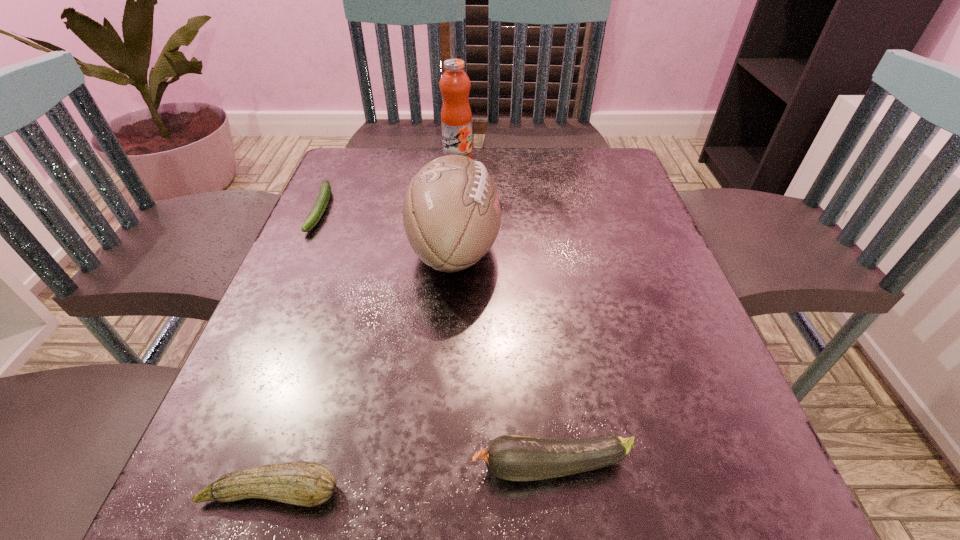
Locate an element on the screen. vacant space located 0.140m at the blossom end of the rightmost zucchini is located at coordinates (371, 466).

This screenshot has width=960, height=540. I want to click on vacant space located on the front-facing side of the farthest zucchini, so click(x=300, y=258).

You are a GUI agent. You are given a task and a screenshot of the screen. Output one action in this format:
    pyautogui.click(x=<x>, y=<y>)
    Task: Click on the fruit juice located at the far edge
    The height and width of the screenshot is (540, 960).
    Given the screenshot: What is the action you would take?
    [x=456, y=118]

What are the coordinates of `zucchini positioned at the far edge` in the screenshot? It's located at (321, 203).

Locate an element on the screen. object that is at the far left corner is located at coordinates (321, 203).

Where is `object at the near left corner`? This screenshot has width=960, height=540. object at the near left corner is located at coordinates click(303, 483).

Image resolution: width=960 pixels, height=540 pixels. I want to click on free space at the far edge of the desktop, so click(409, 160).

Where is `vacant space at the near edge of the desktop`? The width and height of the screenshot is (960, 540). vacant space at the near edge of the desktop is located at coordinates (343, 472).

This screenshot has width=960, height=540. Identify the location of vacant space at the left edge. (259, 414).

In the image, there is a desktop. What are the coordinates of `vacant space at the right edge` in the screenshot? It's located at (647, 348).